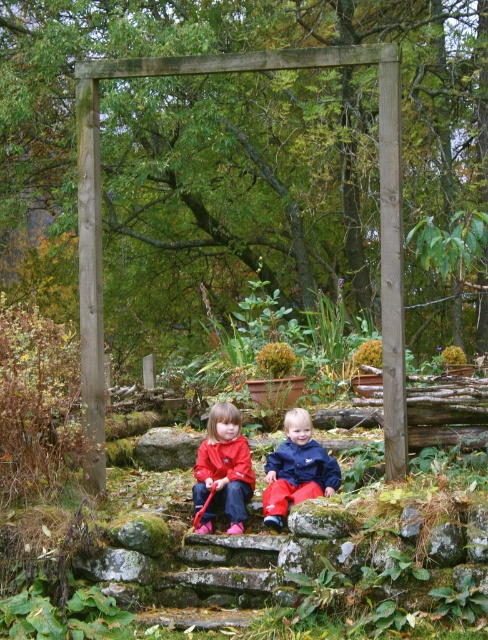
Is matte red jacket at center smaller than matte blue jacket at center?

No.

Does matte red jacket at center have a greater height compared to matte blue jacket at center?

Yes.

Which is behind, point (217, 467) or point (278, 497)?

Point (217, 467)

Identify the location of matte red jacket at center. (223, 468).